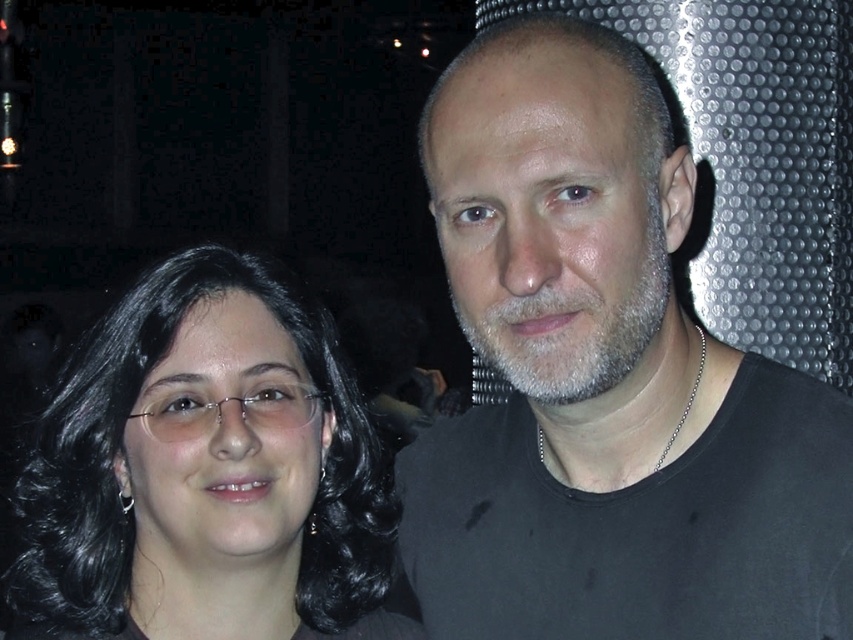
Does black matte shirt at upper right have a greater width compared to black hair at left?

In fact, black matte shirt at upper right might be narrower than black hair at left.

Which of these two, black matte shirt at upper right or black hair at left, stands taller?

With more height is black matte shirt at upper right.

Identify the location of black matte shirt at upper right. The image size is (853, 640). (604, 380).